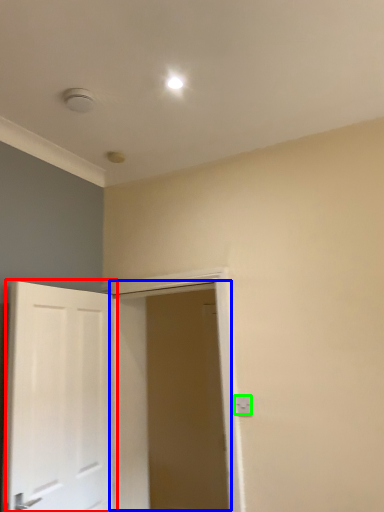
Question: Which is nearer to the door (highlighted by a red box)? door (highlighted by a blue box) or electric outlet (highlighted by a green box).

Choices:
 (A) door
 (B) electric outlet

Answer: (A)